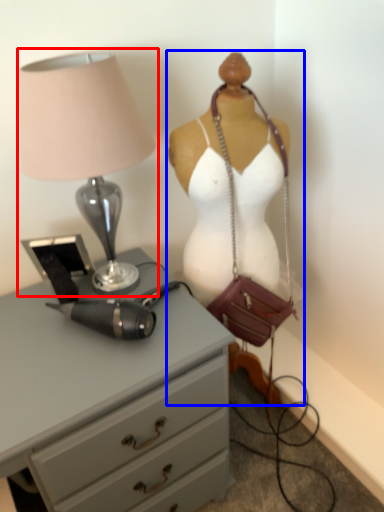
Question: Among these objects, which one is farthest to the camera, lamp (highlighted by a red box) or mannequin (highlighted by a blue box)?

Choices:
 (A) lamp
 (B) mannequin

Answer: (B)